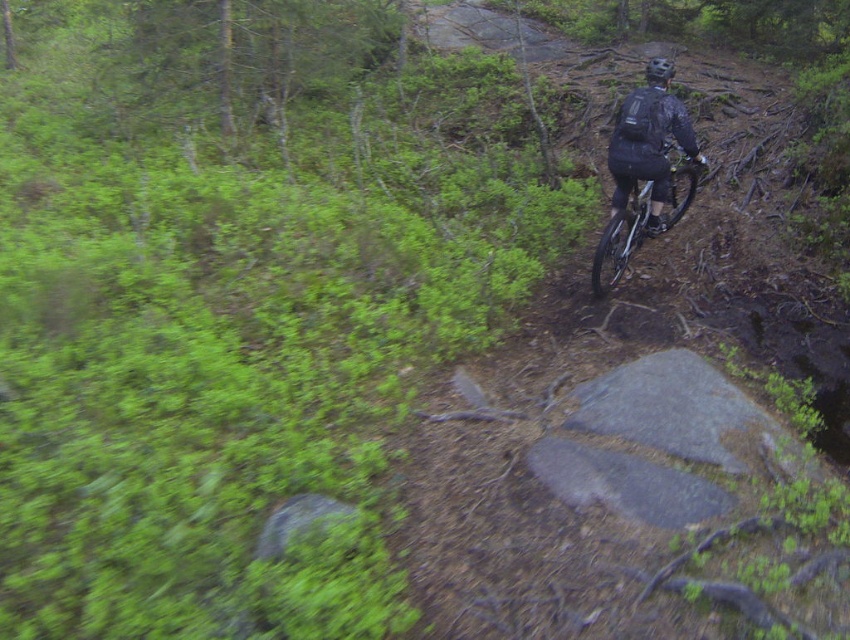
You are a photographer trying to capture the mountain biker in action. You notice the black matte jacket at upper right and the silver metallic bicycle at center. Which object should you focus on if you want to photograph the smaller one?

The black matte jacket at upper right has a smaller size compared to the silver metallic bicycle at center, so you should focus on the black matte jacket at upper right to photograph the smaller one.

You are a photographer trying to capture the mountain biker in the center of your photo. You notice two points on the trail marked as point [620,180] and point [666,58]. Which point should you focus on to ensure the biker is in sharp focus if you want the closer point to be in focus?

You should focus on point [620,180] because it is closer to the camera than point [666,58].